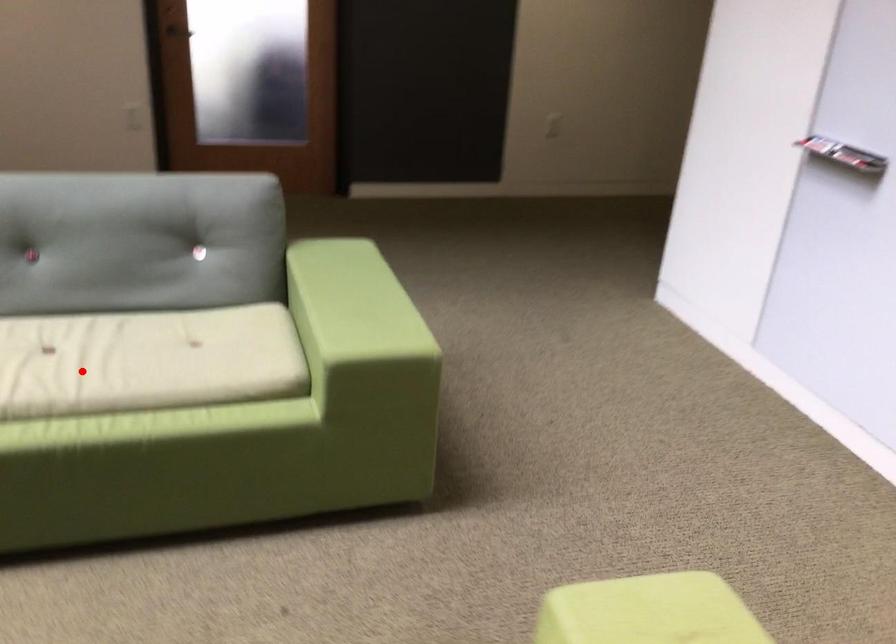
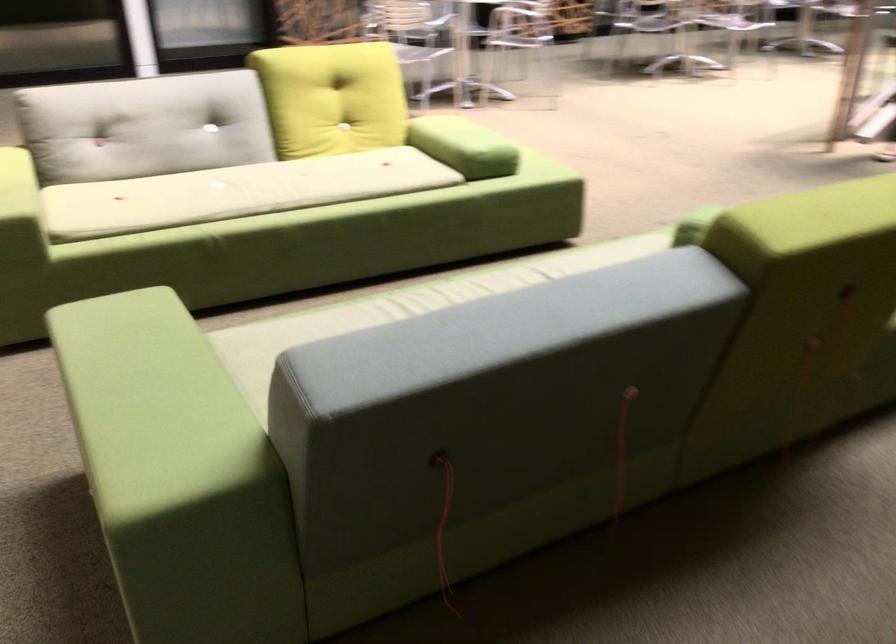
Where in the second image is the point corresponding to the highlighted location from the first image?

(401, 308)